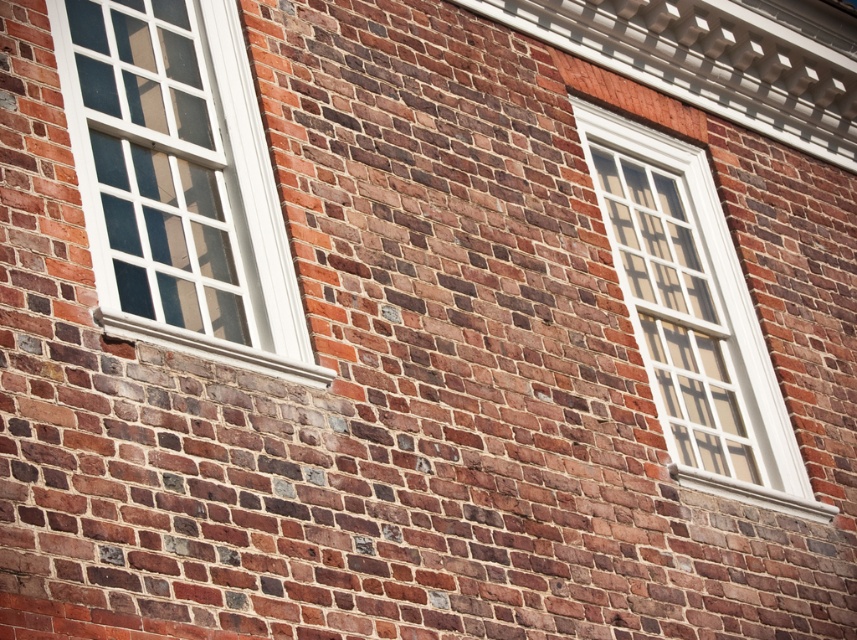
Question: Is white wood window at left positioned before white glass window at upper right?

Choices:
 (A) no
 (B) yes

Answer: (B)

Question: Does white wood window at left appear on the right side of white glass window at upper right?

Choices:
 (A) no
 (B) yes

Answer: (A)

Question: Which object appears farthest from the camera in this image?

Choices:
 (A) white wood window at left
 (B) white glass window at upper right

Answer: (B)

Question: Which object appears farthest from the camera in this image?

Choices:
 (A) white glass window at upper right
 (B) white wood window at left

Answer: (A)

Question: Which point is farther to the camera?

Choices:
 (A) (105, 326)
 (B) (699, 452)

Answer: (B)

Question: Is white wood window at left further to the viewer compared to white glass window at upper right?

Choices:
 (A) no
 (B) yes

Answer: (A)